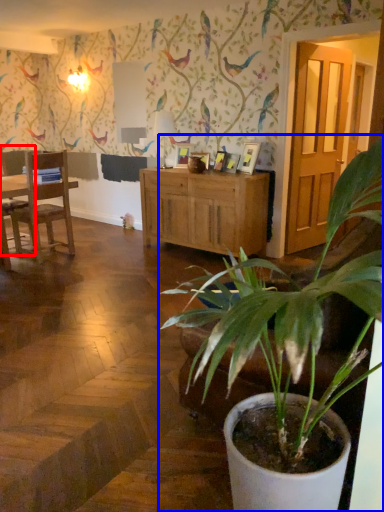
Question: Which object appears farthest to the camera in this image, chair (highlighted by a red box) or houseplant (highlighted by a blue box)?

Choices:
 (A) chair
 (B) houseplant

Answer: (A)